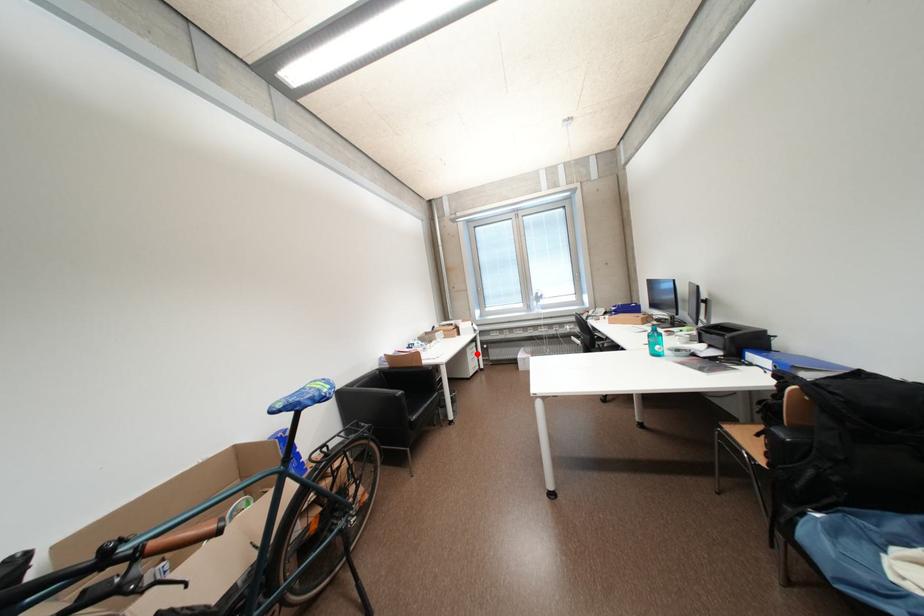
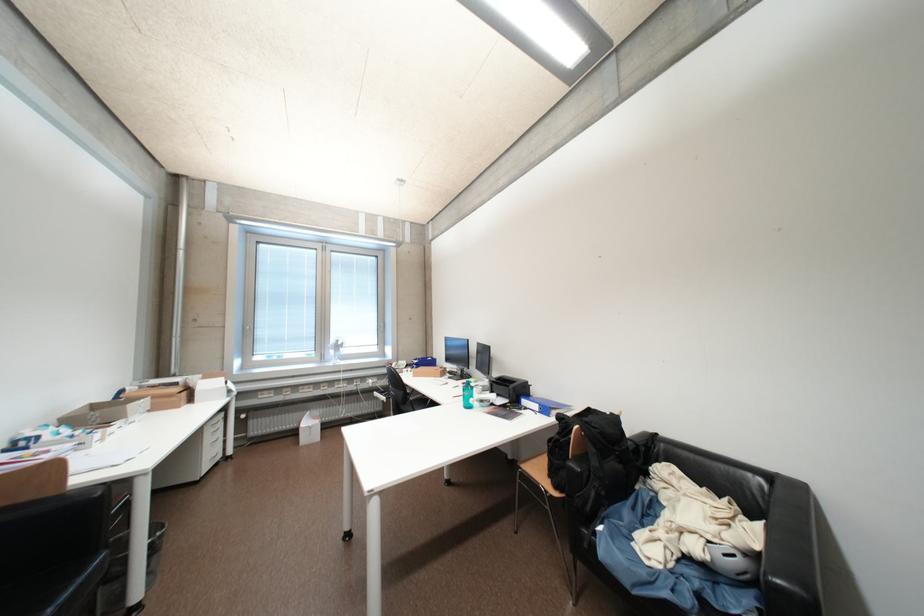
The point at the highlighted location is marked in the first image. Where is the corresponding point in the second image?

(216, 432)